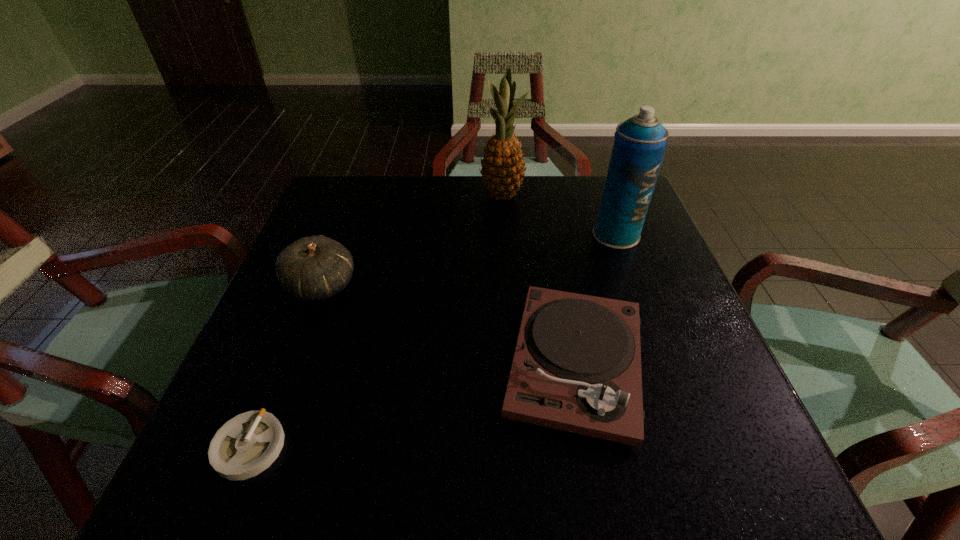
Where is `pineapple that is at the far edge`? pineapple that is at the far edge is located at coordinates (503, 169).

You are a GUI agent. You are given a task and a screenshot of the screen. Output one action in this format:
    pyautogui.click(x=<x>, y=<y>)
    Task: Click on the aerosol can located at the far edge
    This screenshot has height=540, width=960.
    Given the screenshot: What is the action you would take?
    pyautogui.click(x=640, y=143)

Where is `phonograph_record present at the near edge`? The image size is (960, 540). phonograph_record present at the near edge is located at coordinates (576, 367).

Locate an element on the screen. ashtray that is at the near edge is located at coordinates (246, 445).

Where is `gourd located in the left edge section of the desktop`? gourd located in the left edge section of the desktop is located at coordinates (312, 268).

This screenshot has width=960, height=540. What are the coordinates of `ashtray located at the left edge` in the screenshot? It's located at (246, 445).

The height and width of the screenshot is (540, 960). Find the location of `aerosol can positioned at the right edge`. aerosol can positioned at the right edge is located at coordinates (640, 143).

Find the location of a particular element. phonograph_record that is positioned at the right edge is located at coordinates (576, 367).

You are a GUI agent. You are given a task and a screenshot of the screen. Output one action in this format:
    pyautogui.click(x=<x>, y=<y>)
    Task: Click on the object present at the near left corner
    
    Given the screenshot: What is the action you would take?
    pyautogui.click(x=246, y=445)

At what (x,y) coordinates should I click in order to perform the action: click on object present at the far right corner. Please return your answer as a coordinate pair (x, y). The width and height of the screenshot is (960, 540). Looking at the image, I should click on (640, 143).